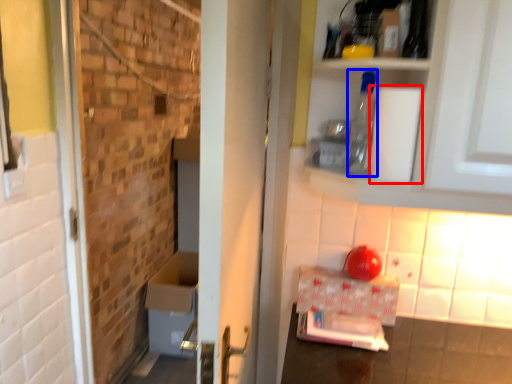
Question: Which of the following is the closest to the observer, toilet paper (highlighted by a red box) or bottle (highlighted by a blue box)?

Choices:
 (A) toilet paper
 (B) bottle

Answer: (A)